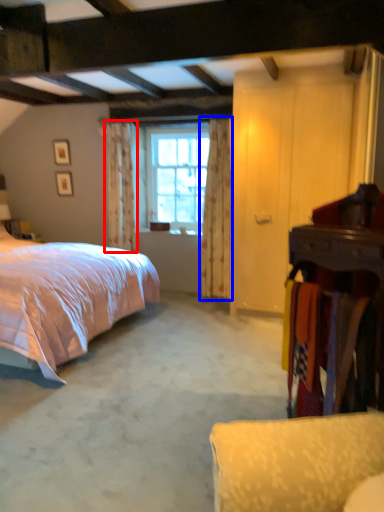
Question: Which of the following is the farthest to the observer, curtain (highlighted by a red box) or curtain (highlighted by a blue box)?

Choices:
 (A) curtain
 (B) curtain

Answer: (A)